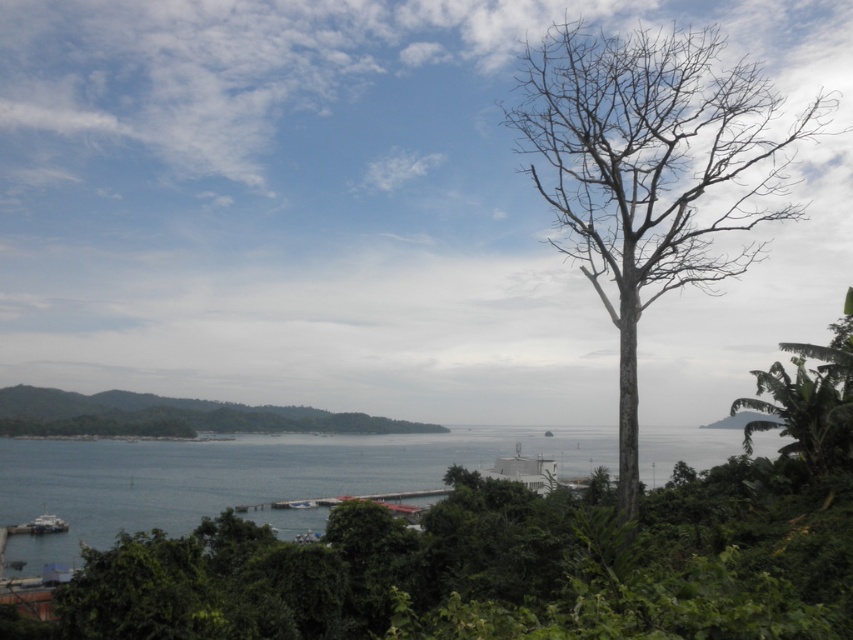
Question: Can you confirm if bare wood tree at right is thinner than blue water at center?

Choices:
 (A) no
 (B) yes

Answer: (B)

Question: In this image, where is green leafy tree at lower left located relative to green leafy tree at right?

Choices:
 (A) left
 (B) right

Answer: (A)

Question: Which is farther from the green leafy tree at right?

Choices:
 (A) green leafy tree at lower left
 (B) blue water at center
 (C) bare wood tree at right

Answer: (A)

Question: Does bare wood tree at right have a greater width compared to green leafy tree at right?

Choices:
 (A) yes
 (B) no

Answer: (A)

Question: Which object is positioned farthest from the green leafy tree at lower left?

Choices:
 (A) bare wood tree at right
 (B) green leafy tree at right

Answer: (B)

Question: Which point is farther to the camera?

Choices:
 (A) (828, 102)
 (B) (317, 486)

Answer: (A)